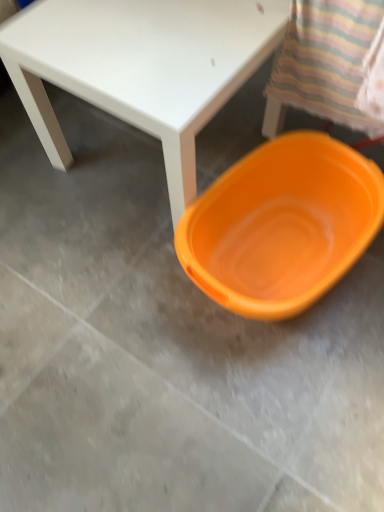
Question: Is orange plastic basin at lower right surrounded by matte white table at center?

Choices:
 (A) yes
 (B) no

Answer: (B)

Question: Is matte white table at center closer to camera compared to orange plastic basin at lower right?

Choices:
 (A) yes
 (B) no

Answer: (A)

Question: Can you confirm if matte white table at center is thinner than orange plastic basin at lower right?

Choices:
 (A) yes
 (B) no

Answer: (A)

Question: Does matte white table at center appear on the left side of orange plastic basin at lower right?

Choices:
 (A) no
 (B) yes

Answer: (B)

Question: Can you confirm if matte white table at center is taller than orange plastic basin at lower right?

Choices:
 (A) no
 (B) yes

Answer: (B)

Question: Is matte white table at center at the right side of orange plastic basin at lower right?

Choices:
 (A) no
 (B) yes

Answer: (A)

Question: Does orange plastic basin at lower right have a lesser height compared to matte white table at center?

Choices:
 (A) yes
 (B) no

Answer: (A)

Question: Is orange plastic basin at lower right not inside matte white table at center?

Choices:
 (A) yes
 (B) no

Answer: (A)

Question: Is the depth of orange plastic basin at lower right less than that of matte white table at center?

Choices:
 (A) no
 (B) yes

Answer: (A)

Question: Can you confirm if orange plastic basin at lower right is positioned to the left of matte white table at center?

Choices:
 (A) yes
 (B) no

Answer: (B)

Question: Considering the relative sizes of orange plastic basin at lower right and matte white table at center in the image provided, is orange plastic basin at lower right thinner than matte white table at center?

Choices:
 (A) no
 (B) yes

Answer: (A)

Question: Does orange plastic basin at lower right come behind matte white table at center?

Choices:
 (A) no
 (B) yes

Answer: (B)

Question: Considering their positions, is orange plastic basin at lower right located in front of or behind matte white table at center?

Choices:
 (A) front
 (B) behind

Answer: (B)